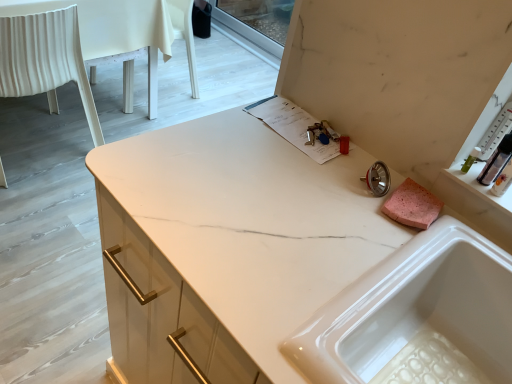
Question: Is the depth of white marble countertop at center less than that of white glossy sink at upper right?

Choices:
 (A) yes
 (B) no

Answer: (A)

Question: From a real-world perspective, is white marble countertop at center located higher than white glossy sink at upper right?

Choices:
 (A) yes
 (B) no

Answer: (B)

Question: Is white marble countertop at center next to white glossy sink at upper right and touching it?

Choices:
 (A) no
 (B) yes

Answer: (A)

Question: Could white glossy sink at upper right be considered to be inside white marble countertop at center?

Choices:
 (A) yes
 (B) no

Answer: (A)

Question: Is white marble countertop at center looking in the opposite direction of white glossy sink at upper right?

Choices:
 (A) no
 (B) yes

Answer: (A)

Question: In terms of width, does white glossy sink at upper right look wider or thinner when compared to clear plastic bottle at upper right?

Choices:
 (A) thin
 (B) wide

Answer: (B)

Question: From a real-world perspective, is white glossy sink at upper right physically located above or below clear plastic bottle at upper right?

Choices:
 (A) below
 (B) above

Answer: (A)

Question: From the image's perspective, relative to clear plastic bottle at upper right, is white glossy sink at upper right above or below?

Choices:
 (A) below
 (B) above

Answer: (A)

Question: Based on their positions, is white glossy sink at upper right located to the left or right of clear plastic bottle at upper right?

Choices:
 (A) right
 (B) left

Answer: (B)

Question: From the image's perspective, is white fabric chair at left positioned above or below clear plastic bottle at upper right?

Choices:
 (A) below
 (B) above

Answer: (B)

Question: Based on their positions, is white fabric chair at left located to the left or right of clear plastic bottle at upper right?

Choices:
 (A) left
 (B) right

Answer: (A)

Question: Is white fabric chair at left wider or thinner than clear plastic bottle at upper right?

Choices:
 (A) thin
 (B) wide

Answer: (B)

Question: Is point (7, 29) positioned closer to the camera than point (501, 148)?

Choices:
 (A) closer
 (B) farther

Answer: (B)

Question: From their relative heights in the image, would you say white glossy sink at upper right is taller or shorter than white fabric chair at left?

Choices:
 (A) short
 (B) tall

Answer: (A)

Question: Is white glossy sink at upper right inside the boundaries of white fabric chair at left, or outside?

Choices:
 (A) outside
 (B) inside

Answer: (A)